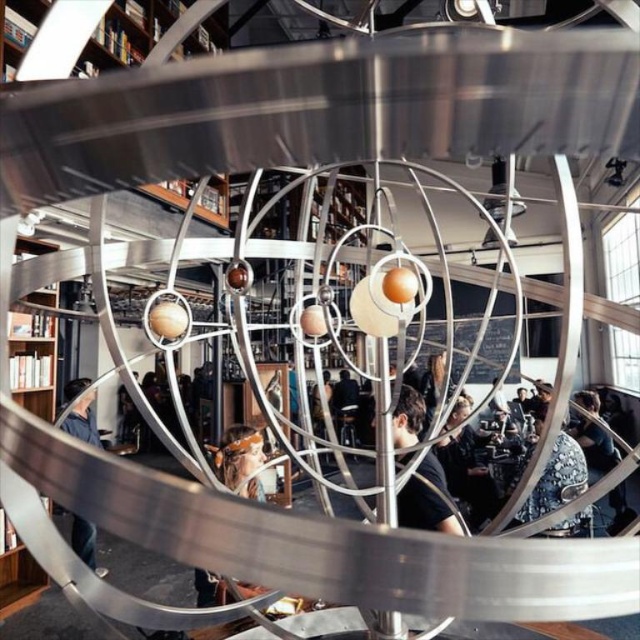
Question: Among these points, which one is nearest to the camera?

Choices:
 (A) (17, 563)
 (B) (406, 444)
 (C) (237, 461)

Answer: (B)

Question: Can you confirm if brown wooden bookshelf at left is bigger than matte black shirt at center?

Choices:
 (A) yes
 (B) no

Answer: (B)

Question: Which object is positioned closest to the brown leather jacket at center?

Choices:
 (A) brown wooden bookshelf at left
 (B) matte black shirt at center
 (C) denim jacket at lower left

Answer: (B)

Question: Does brown wooden bookshelf at left have a lesser width compared to brown leather jacket at center?

Choices:
 (A) yes
 (B) no

Answer: (B)

Question: Which point is farther to the camera?

Choices:
 (A) (440, 508)
 (B) (228, 486)
 (C) (10, 600)

Answer: (C)

Question: Is matte black shirt at center below denim jacket at lower left?

Choices:
 (A) no
 (B) yes

Answer: (A)